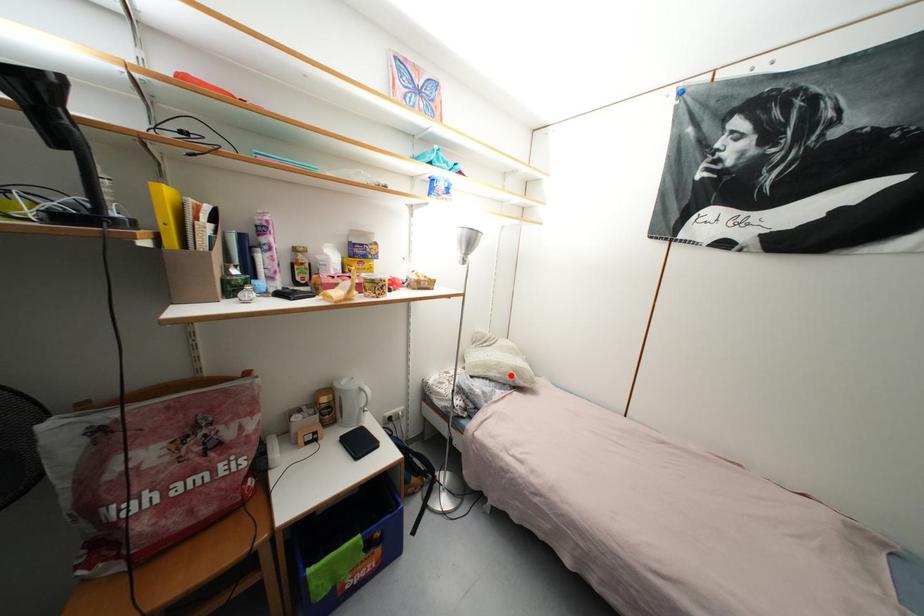
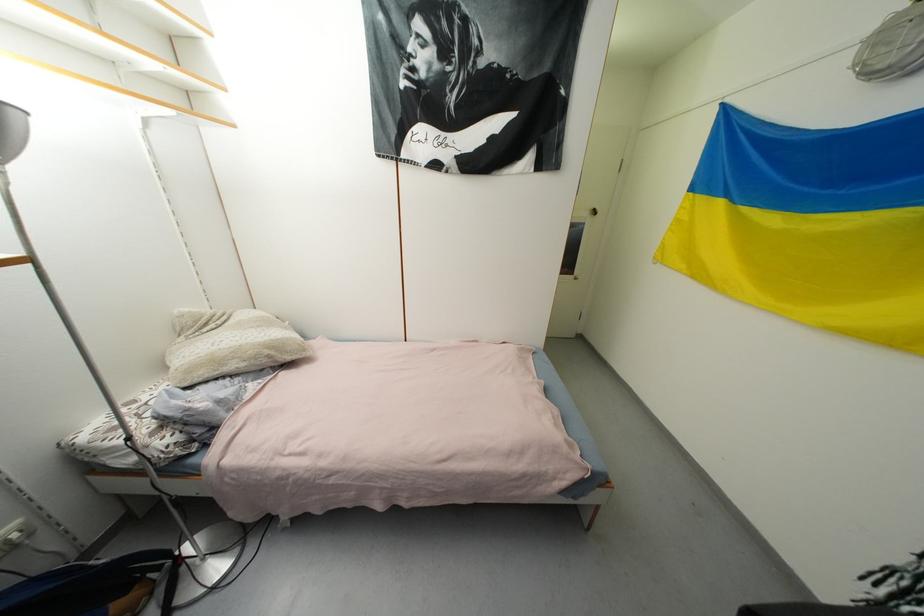
In the second image, find the point that corresponds to the highlighted location in the first image.

(261, 359)